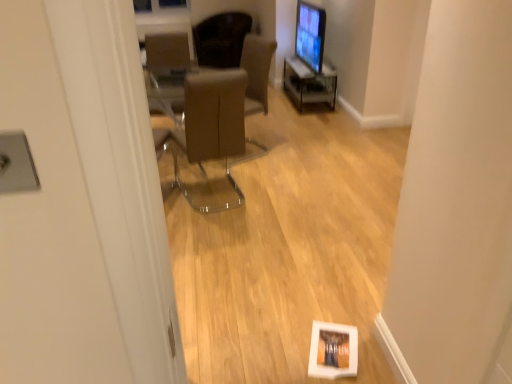
Locate an element on the screen. vacant space underneath brown leather chair at center, the third chair positioned from the top (from a real-world perspective) is located at coordinates (206, 193).